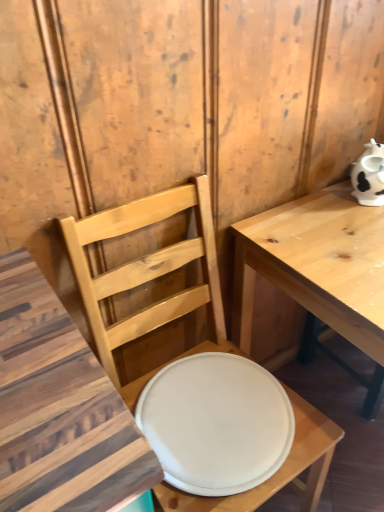
Question: Is light wood table at right bigger or smaller than white matte plate at center?

Choices:
 (A) small
 (B) big

Answer: (B)

Question: Is light wood table at right wider or thinner than white matte plate at center?

Choices:
 (A) thin
 (B) wide

Answer: (B)

Question: Based on their relative distances, which object is nearer to the white matte plate at center?

Choices:
 (A) matte wood chair at center
 (B) light wood table at right

Answer: (A)

Question: Based on their relative distances, which object is farther from the light wood table at right?

Choices:
 (A) matte wood chair at center
 (B) white matte plate at center

Answer: (B)